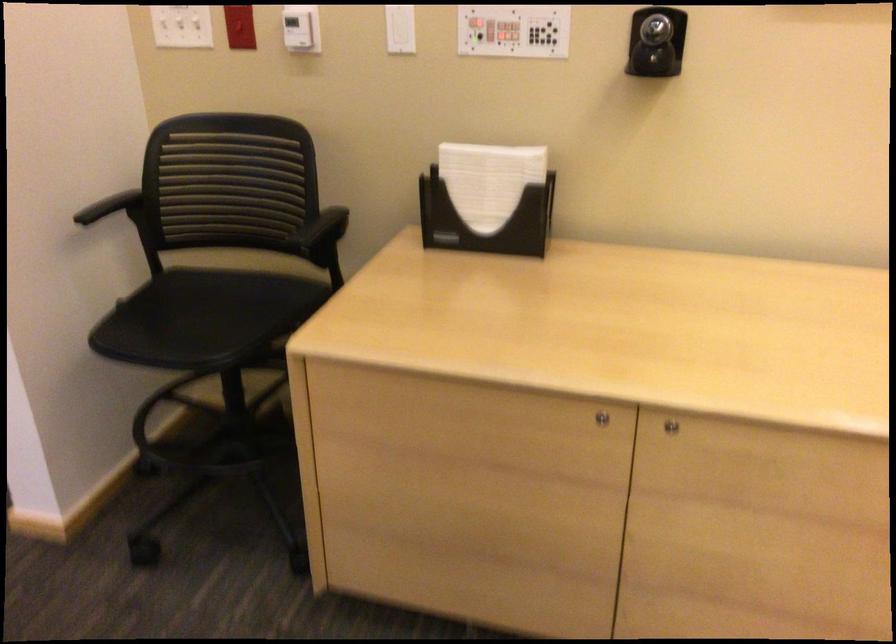
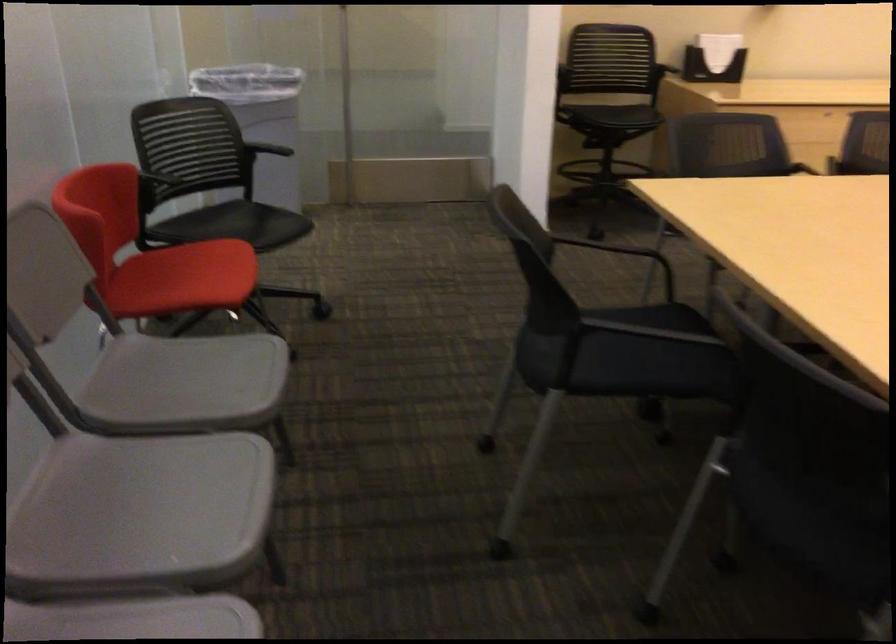
In a continuous first-person perspective shot, in which direction is the camera moving?

The cameraman walked toward left, backward.